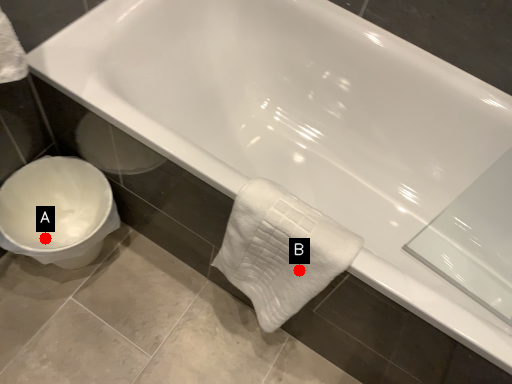
Question: Two points are circled on the image, labeled by A and B beside each circle. Which point is closer to the camera?

Choices:
 (A) A is closer
 (B) B is closer

Answer: (B)